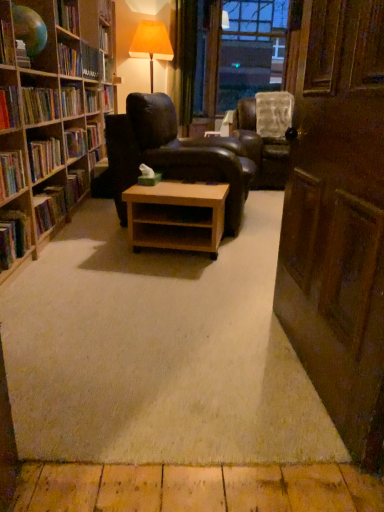
The height and width of the screenshot is (512, 384). I want to click on free region on the left part of light brown wood at center, so point(100,250).